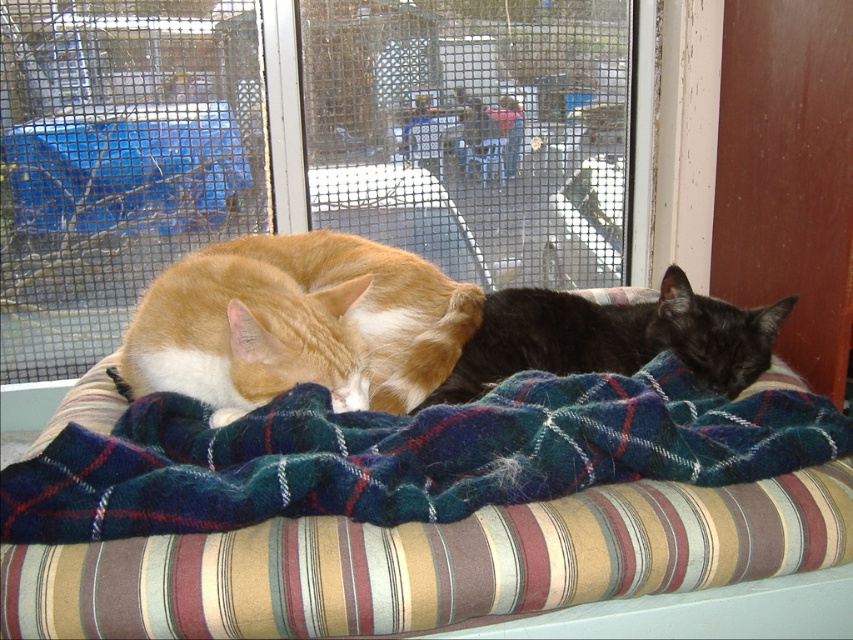
Question: Is orange fur cat at center thinner than brown wood screen door at upper right?

Choices:
 (A) no
 (B) yes

Answer: (A)

Question: Among these points, which one is farthest from the camera?

Choices:
 (A) (315, 365)
 (B) (57, 40)

Answer: (B)

Question: Estimate the real-world distances between objects in this image. Which object is closer to the orange fur cat at center?

Choices:
 (A) black silky cat at center
 (B) blue fabric chair at center
 (C) plaid woolen blanket at center

Answer: (C)

Question: Observing the image, what is the correct spatial positioning of brown wood screen door at upper right in reference to blue fabric chair at center?

Choices:
 (A) left
 (B) right

Answer: (B)

Question: Does orange fur cat at center have a smaller size compared to blue fabric chair at center?

Choices:
 (A) yes
 (B) no

Answer: (B)

Question: Estimate the real-world distances between objects in this image. Which object is closer to the plaid woolen blanket at center?

Choices:
 (A) black silky cat at center
 (B) orange fur cat at center
 (C) clear glass window at center
 (D) blue fabric chair at center

Answer: (B)